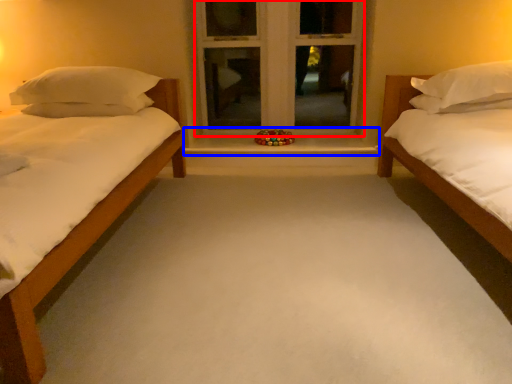
Question: Among these objects, which one is nearest to the camera, window frame (highlighted by a red box) or window sill (highlighted by a blue box)?

Choices:
 (A) window frame
 (B) window sill

Answer: (B)